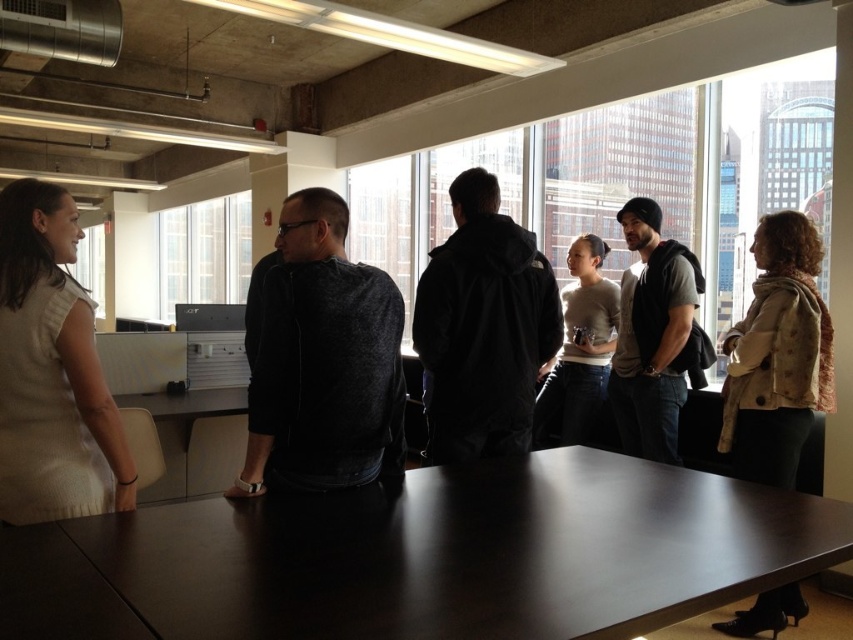
Question: Which point is closer to the camera taking this photo?

Choices:
 (A) (341, 452)
 (B) (579, 355)
 (C) (68, 500)

Answer: (C)

Question: Which point appears farthest from the camera in this image?

Choices:
 (A) (599, 528)
 (B) (643, 285)
 (C) (44, 445)

Answer: (B)

Question: From the image, what is the correct spatial relationship of dark brown wooden table at center in relation to light beige sweater at center?

Choices:
 (A) below
 (B) above

Answer: (A)

Question: Which is farther from the dark gray sweater at center?

Choices:
 (A) dark brown wooden table at center
 (B) dark gray hoodie at center
 (C) light beige sleeveless top at left

Answer: (B)

Question: Does black matte jacket at center appear over light beige sweater at center?

Choices:
 (A) yes
 (B) no

Answer: (A)

Question: In this image, where is dark gray sweater at center located relative to light beige sweater at center?

Choices:
 (A) above
 (B) below

Answer: (A)